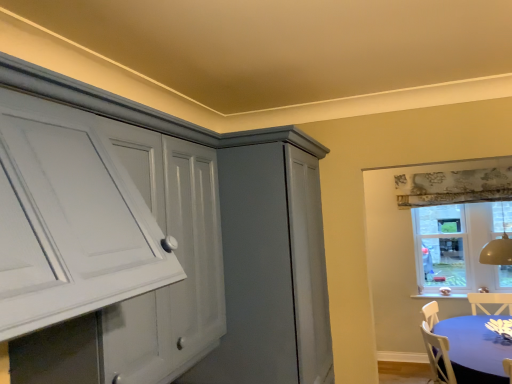
Question: Is blue fabric table at lower right outside of clear glass window at upper right?

Choices:
 (A) yes
 (B) no

Answer: (A)

Question: Considering the relative sizes of blue fabric table at lower right and clear glass window at upper right in the image provided, is blue fabric table at lower right thinner than clear glass window at upper right?

Choices:
 (A) yes
 (B) no

Answer: (B)

Question: From a real-world perspective, is blue fabric table at lower right positioned under clear glass window at upper right based on gravity?

Choices:
 (A) no
 (B) yes

Answer: (B)

Question: Is blue fabric table at lower right at the right side of clear glass window at upper right?

Choices:
 (A) yes
 (B) no

Answer: (B)

Question: Considering the relative sizes of blue fabric table at lower right and clear glass window at upper right in the image provided, is blue fabric table at lower right smaller than clear glass window at upper right?

Choices:
 (A) no
 (B) yes

Answer: (A)

Question: Can you confirm if blue fabric table at lower right is taller than clear glass window at upper right?

Choices:
 (A) no
 (B) yes

Answer: (A)

Question: Is clear glass window at upper right positioned behind blue fabric table at lower right?

Choices:
 (A) no
 (B) yes

Answer: (B)

Question: Is clear glass window at upper right at the right side of blue fabric table at lower right?

Choices:
 (A) yes
 (B) no

Answer: (A)

Question: From the image's perspective, is clear glass window at upper right located above blue fabric table at lower right?

Choices:
 (A) yes
 (B) no

Answer: (A)

Question: Considering the relative sizes of clear glass window at upper right and blue fabric table at lower right in the image provided, is clear glass window at upper right bigger than blue fabric table at lower right?

Choices:
 (A) no
 (B) yes

Answer: (A)

Question: Is clear glass window at upper right wider than blue fabric table at lower right?

Choices:
 (A) yes
 (B) no

Answer: (B)

Question: Is blue fabric table at lower right surrounded by clear glass window at upper right?

Choices:
 (A) yes
 (B) no

Answer: (B)

Question: From a real-world perspective, is clear glass window at upper right physically located above or below blue fabric table at lower right?

Choices:
 (A) below
 (B) above

Answer: (B)